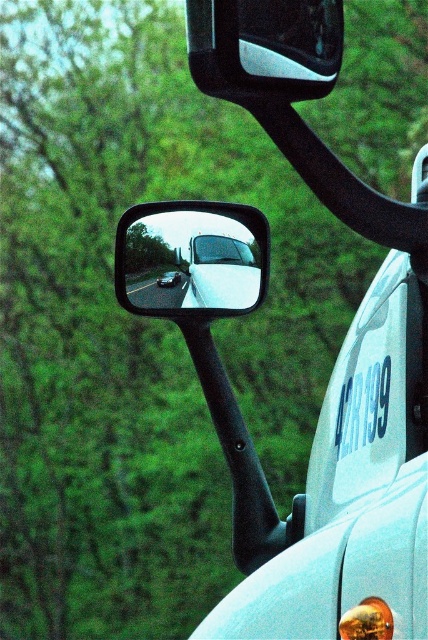
Question: Is clear glass mirror at center to the left of transparent glass windshield at center from the viewer's perspective?

Choices:
 (A) yes
 (B) no

Answer: (A)

Question: Observing the image, what is the correct spatial positioning of matte black mirror at upper center in reference to shiny silver sedan at center?

Choices:
 (A) right
 (B) left

Answer: (A)

Question: Which object is positioned closest to the shiny silver sedan at center?

Choices:
 (A) transparent glass windshield at center
 (B) white plastic license plate at center-right
 (C) matte black mirror at upper center
 (D) clear glass mirror at center

Answer: (D)

Question: Which point is closer to the camera?

Choices:
 (A) (250, 262)
 (B) (363, 410)

Answer: (B)

Question: Based on their relative distances, which object is farther from the matte black mirror at upper center?

Choices:
 (A) white plastic license plate at center-right
 (B) shiny silver sedan at center
 (C) clear glass mirror at center

Answer: (B)

Question: In this image, where is matte black mirror at upper center located relative to transparent glass windshield at center?

Choices:
 (A) right
 (B) left

Answer: (A)